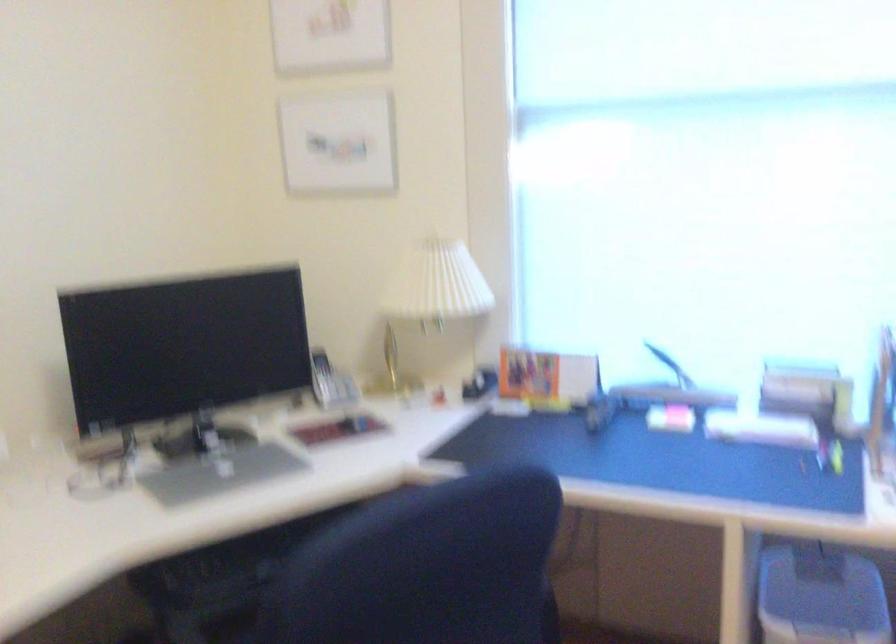
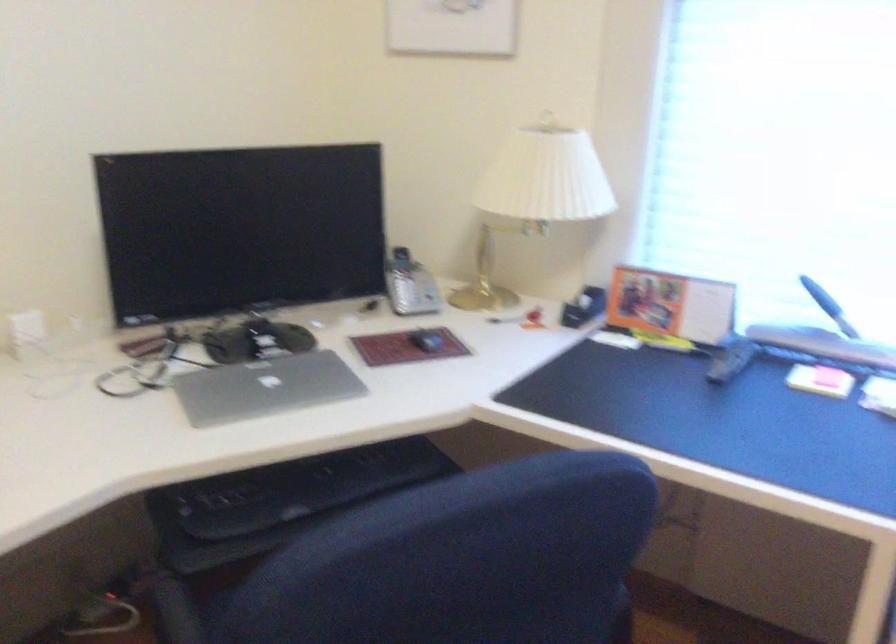
Find the pixel in the second image that matches [220,477] in the first image.

(264, 386)